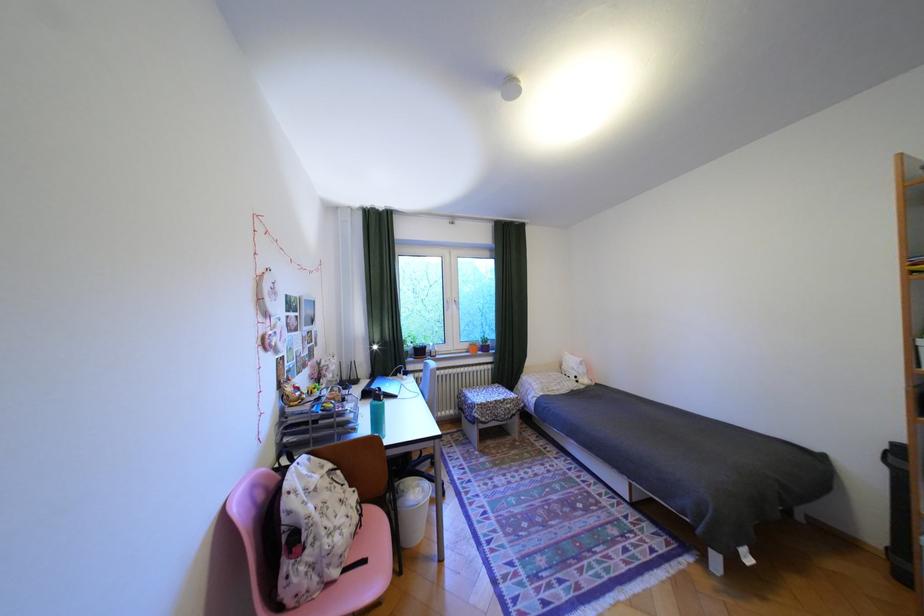
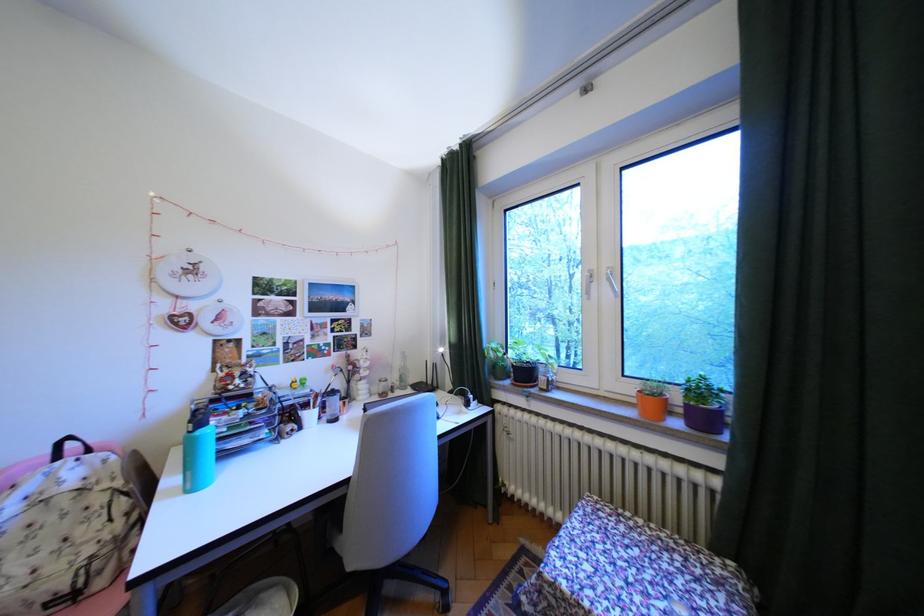
In the second image, find the point that corresponds to point (338, 495) in the first image.

(65, 519)